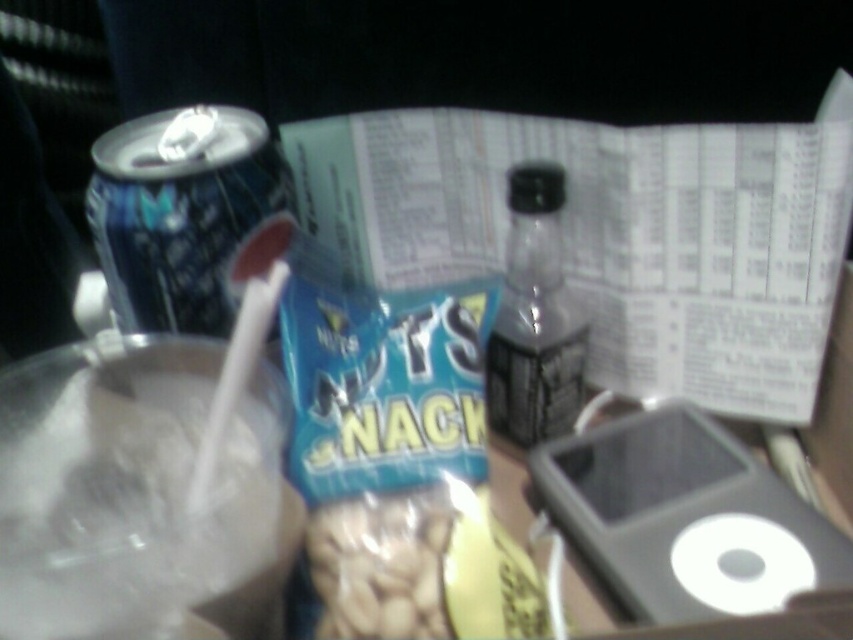
You are a passenger in a car and want to grab a drink from the clear glass bottle at center and the translucent plastic peanuts at center. Which one is larger in size?

The clear glass bottle at center is bigger than the translucent plastic peanuts at center, so the clear glass bottle at center is larger in size.

You are a passenger in a car and want to grab a drink. The blue metallic can at left is located at point 0.338, 0.219. Is the can closer to the front or back of the car?

The blue metallic can at left is positioned at point (186,216), which indicates it is closer to the front of the car.